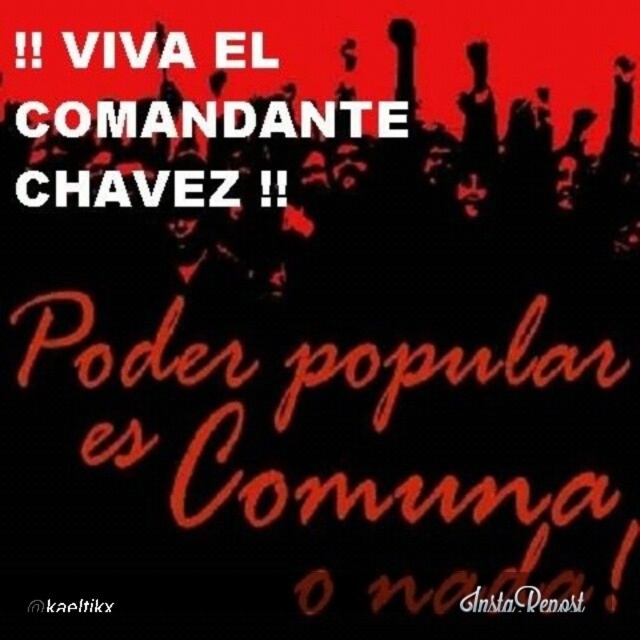
Question: In this image, where is black instarepost at upper center located relative to black text at upper center?

Choices:
 (A) above
 (B) below

Answer: (A)

Question: Which object is positioned farthest from the black text at upper center?

Choices:
 (A) black instarepost at upper center
 (B) white text at upper left

Answer: (B)

Question: Among these points, which one is farthest from the camera?

Choices:
 (A) (77, 602)
 (B) (582, 605)

Answer: (B)

Question: Does black instarepost at upper center appear under black text at upper center?

Choices:
 (A) yes
 (B) no

Answer: (B)

Question: Can you confirm if white text at upper left is positioned to the right of black text at upper center?

Choices:
 (A) no
 (B) yes

Answer: (B)

Question: Which object is positioned closest to the black instarepost at upper center?

Choices:
 (A) white text at upper left
 (B) black text at upper center

Answer: (B)